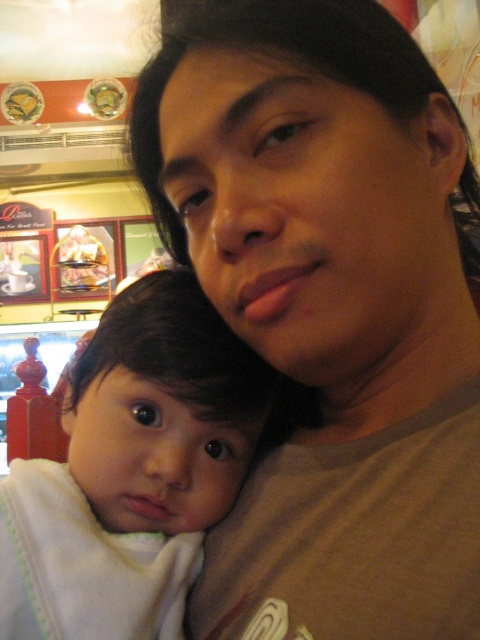
You are a photographer trying to capture a candid shot of the matte brown shirt at center and the white soft baby at center. Since you want to ensure both subjects are in focus, you need to know which one is closer to the camera. Can you determine which subject is nearer to the camera based on their positions?

The matte brown shirt at center is taller than the white soft baby at center, which suggests that the matte brown shirt at center is closer to the camera since it appears larger in the frame.

You are a photographer adjusting the lighting in a restaurant scene. You need to position a spotlight to highlight the matte brown shirt at center. According to the scene coordinates, where should you aim the spotlight?

The matte brown shirt at center is located at coordinates point (328, 308), so the spotlight should be aimed at that exact point to effectively highlight it.

You are a photographer setting up a shot for a family portrait. You have a camera with a lens that can focus on objects within a 1.2 meter width. You see the matte brown shirt at center and the white soft baby at center in the scene. Can both fit within the camera lens width if they are side by side?

The matte brown shirt at center might be wider than white soft baby at center, so combined their total width could exceed 1.2 meters. Therefore, both might not fit within the camera lens width if placed side by side.